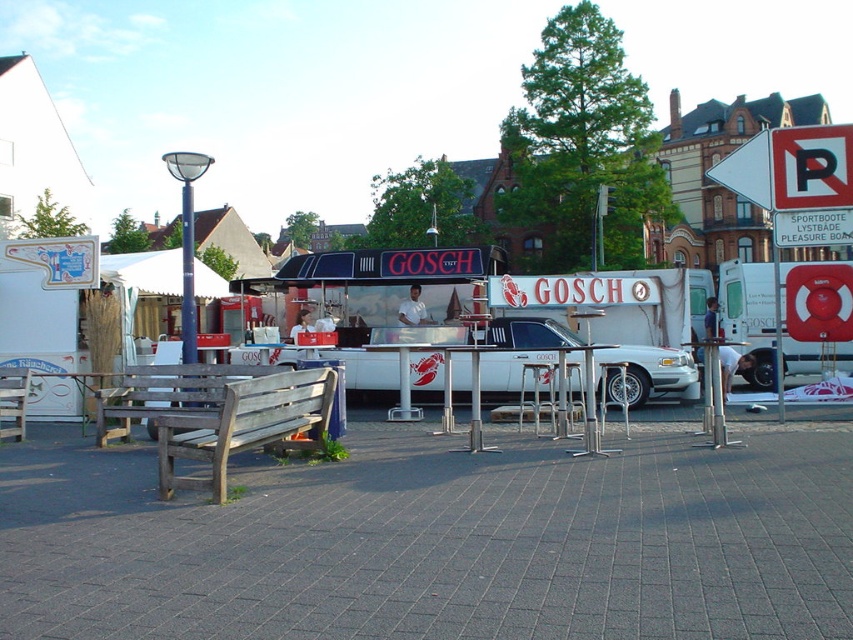
Question: Estimate the real-world distances between objects in this image. Which object is closer to the wooden bench at center?

Choices:
 (A) wooden bench at lower left
 (B) white glossy van at center
 (C) white glossy food truck at center

Answer: (A)

Question: Is white glossy food truck at center to the right of wooden bench at center from the viewer's perspective?

Choices:
 (A) yes
 (B) no

Answer: (A)

Question: Can you confirm if white glossy food truck at center is positioned below wooden bench at center?

Choices:
 (A) no
 (B) yes

Answer: (A)

Question: Which object appears closest to the camera in this image?

Choices:
 (A) white metallic car at center
 (B) wooden park bench at lower left
 (C) white glossy food truck at center
 (D) wooden bench at center

Answer: (B)

Question: Does wooden park bench at lower left come behind wooden bench at center?

Choices:
 (A) yes
 (B) no

Answer: (B)

Question: Which of the following is the farthest from the observer?

Choices:
 (A) (28, 388)
 (B) (758, 310)
 (C) (189, 477)

Answer: (B)